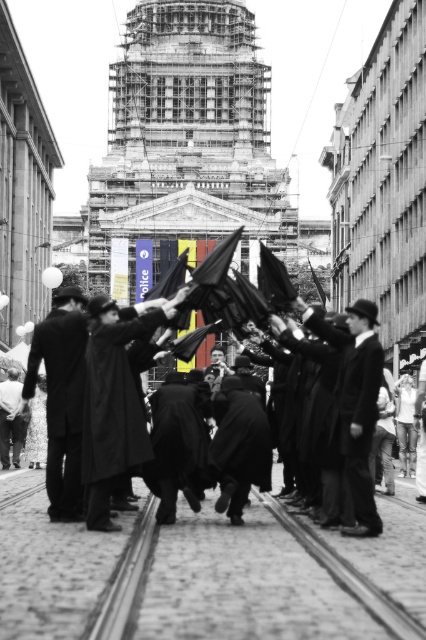
Does smooth black coat at center have a greater height compared to dark wool coat at lower left?

Indeed, smooth black coat at center has a greater height compared to dark wool coat at lower left.

Does smooth black coat at center have a greater width compared to dark wool coat at lower left?

No, smooth black coat at center is not wider than dark wool coat at lower left.

Which is in front, point (368, 346) or point (20, 381)?

Positioned in front is point (368, 346).

This screenshot has height=640, width=426. I want to click on smooth black coat at center, so click(357, 410).

Can you confirm if dark wool coat at center is positioned below dark woolen robe at center?

No.

From the picture: Is dark wool coat at center positioned in front of dark woolen robe at center?

No.

Which is behind, point (48, 372) or point (221, 412)?

The point (221, 412) is behind.

You are a GUI agent. You are given a task and a screenshot of the screen. Output one action in this format:
    pyautogui.click(x=<x>, y=<y>)
    Task: Click on the dark wool coat at center
    Image resolution: width=426 pixels, height=640 pixels.
    Given the screenshot: What is the action you would take?
    pyautogui.click(x=62, y=397)

Who is positioned more to the right, black woolen robe at center or dark wool coat at lower left?

black woolen robe at center is more to the right.

Between black woolen robe at center and dark wool coat at lower left, which one has more height?

Standing taller between the two is black woolen robe at center.

Between point (158, 417) and point (17, 374), which one is positioned behind?

Positioned behind is point (17, 374).

Find the location of a particular element. black woolen robe at center is located at coordinates (176, 442).